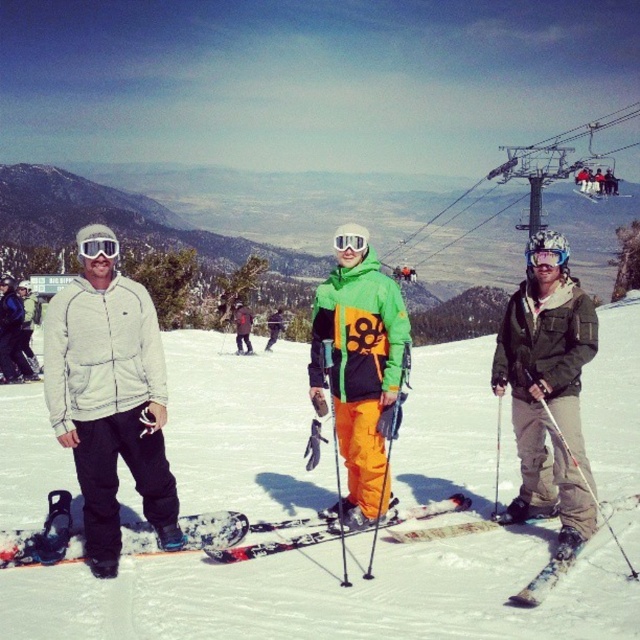
Question: Estimate the real-world distances between objects in this image. Which object is closer to the neon orange ski pants at center?

Choices:
 (A) orange matte ski at center
 (B) white matte goggles at left

Answer: (A)

Question: Among these objects, which one is nearest to the camera?

Choices:
 (A) neon orange ski pants at center
 (B) orange matte snowboard at lower left
 (C) metallic cable car at upper center
 (D) green matte jacket at center

Answer: (D)

Question: Is orange fabric pants at center to the right of white matte jacket at left from the viewer's perspective?

Choices:
 (A) no
 (B) yes

Answer: (B)

Question: Which object is positioned closest to the neon orange ski pants at center?

Choices:
 (A) orange matte snowboard at lower left
 (B) metallic cable car at upper center
 (C) orange fabric pants at center

Answer: (A)

Question: In this image, where is green matte jacket at center located relative to orange matte snowboard at lower left?

Choices:
 (A) right
 (B) left

Answer: (A)

Question: Can you confirm if orange fabric pants at center is positioned to the right of metallic cable car at upper center?

Choices:
 (A) yes
 (B) no

Answer: (B)